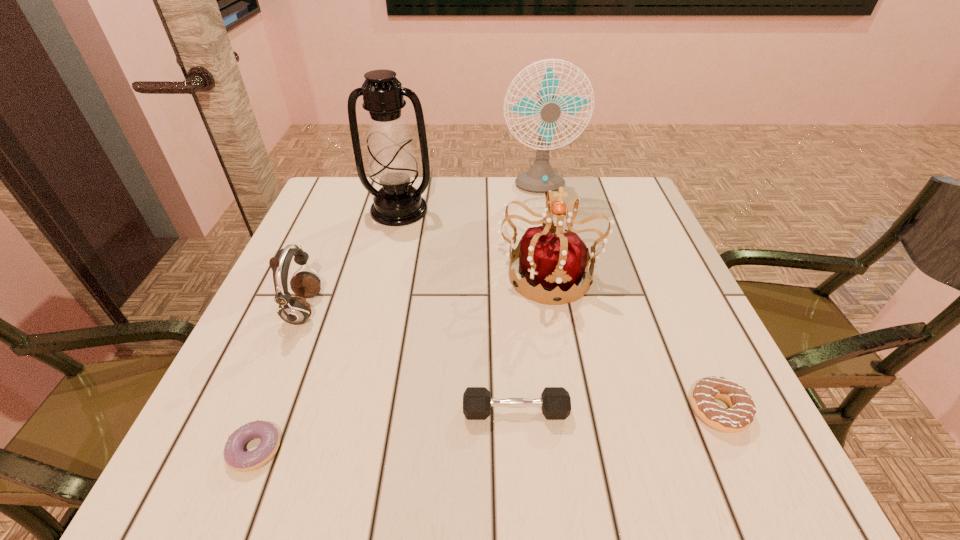
The image size is (960, 540). What are the coordinates of `vacant space situated 0.390m on the right of the fifth object from right to left` in the screenshot? It's located at (580, 210).

Locate an element on the screen. free spot located 0.180m on the front-facing side of the fifth shortest object is located at coordinates (567, 383).

I want to click on vacant space located on the ear pads of the earphone, so click(378, 309).

I want to click on vacant space located 0.260m on the right of the dumbbell, so click(x=725, y=411).

Identify the location of vacant region located 0.170m on the left of the right doughnut. This screenshot has height=540, width=960. (588, 410).

Where is `free spot located on the right of the shortest object`? This screenshot has width=960, height=540. free spot located on the right of the shortest object is located at coordinates (411, 449).

Where is `fan that is positioned at the far edge`? fan that is positioned at the far edge is located at coordinates (541, 177).

Locate an element on the screen. oil lamp that is at the far edge is located at coordinates (392, 163).

Find the location of a particular element. oil lamp present at the left edge is located at coordinates (392, 163).

Where is `earphone present at the left edge`? Image resolution: width=960 pixels, height=540 pixels. earphone present at the left edge is located at coordinates (294, 310).